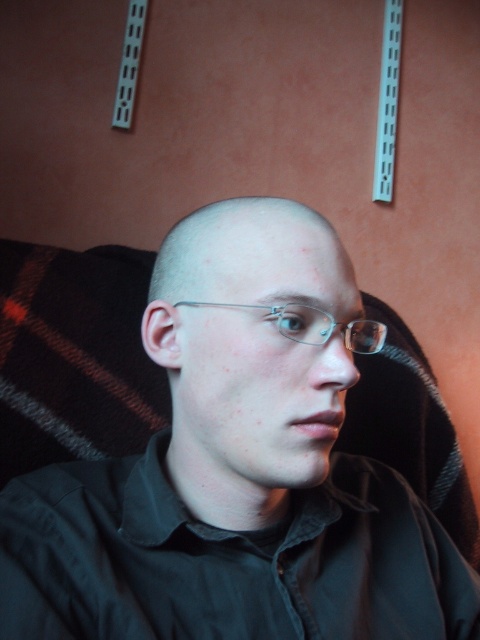
Can you confirm if matte black shirt at center is bigger than matte black glasses at center?

Indeed, matte black shirt at center has a larger size compared to matte black glasses at center.

Looking at this image, is matte black shirt at center below matte black glasses at center?

Correct, matte black shirt at center is located below matte black glasses at center.

Is point (458, 596) positioned before point (216, 260)?

That is False.

Find the location of a particular element. matte black shirt at center is located at coordinates (237, 468).

How much distance is there between matte black shirt at center and clear plastic glasses at center?

matte black shirt at center and clear plastic glasses at center are 4.56 inches apart.

Find the location of a particular element. matte black shirt at center is located at coordinates (237, 468).

The width and height of the screenshot is (480, 640). Identify the location of matte black shirt at center. coord(237,468).

In the scene shown: Does matte black glasses at center have a lesser width compared to clear plastic glasses at center?

Incorrect, matte black glasses at center's width is not less than clear plastic glasses at center's.

The height and width of the screenshot is (640, 480). What are the coordinates of `matte black glasses at center` in the screenshot? It's located at (251, 348).